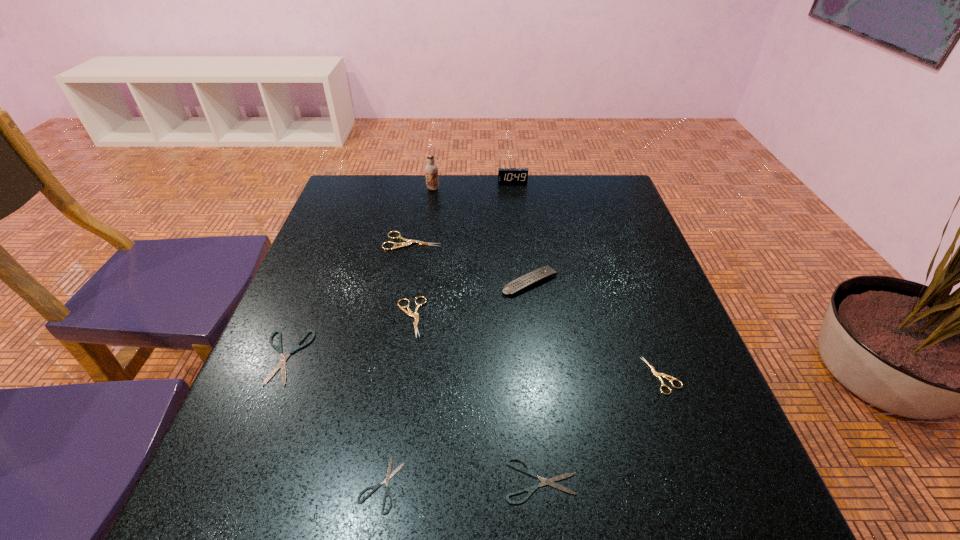
The height and width of the screenshot is (540, 960). Find the location of `the farthest black shears`. the farthest black shears is located at coordinates (281, 364).

Identify the location of the biggest black shears. This screenshot has height=540, width=960. (281, 364).

Locate an element on the screen. The width and height of the screenshot is (960, 540). the rightmost beige shears is located at coordinates (657, 374).

Identify the location of the smallest beige shears. The width and height of the screenshot is (960, 540). (657, 374).

Find the location of a particular element. This screenshot has width=960, height=540. the second shears from right to left is located at coordinates (550, 482).

Image resolution: width=960 pixels, height=540 pixels. I want to click on the second biggest black shears, so click(550, 482).

The width and height of the screenshot is (960, 540). Identify the location of the second black shears from right to left. (389, 476).

Identify the location of the shortest shears. (389, 476).

Where is `vacant area situated on the right of the tallest object`? This screenshot has width=960, height=540. vacant area situated on the right of the tallest object is located at coordinates (550, 188).

At what (x,y) coordinates should I click in order to perform the action: click on free space located on the front-facing side of the alarm clock. Please return your answer as a coordinate pair (x, y). The width and height of the screenshot is (960, 540). Looking at the image, I should click on (515, 199).